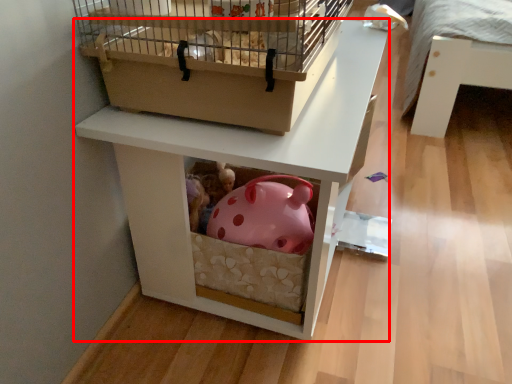
Question: From the image's perspective, considering the relative positions of furniture (annotated by the red box) and bird cage in the image provided, where is furniture (annotated by the red box) located with respect to the staircase?

Choices:
 (A) below
 (B) above

Answer: (A)